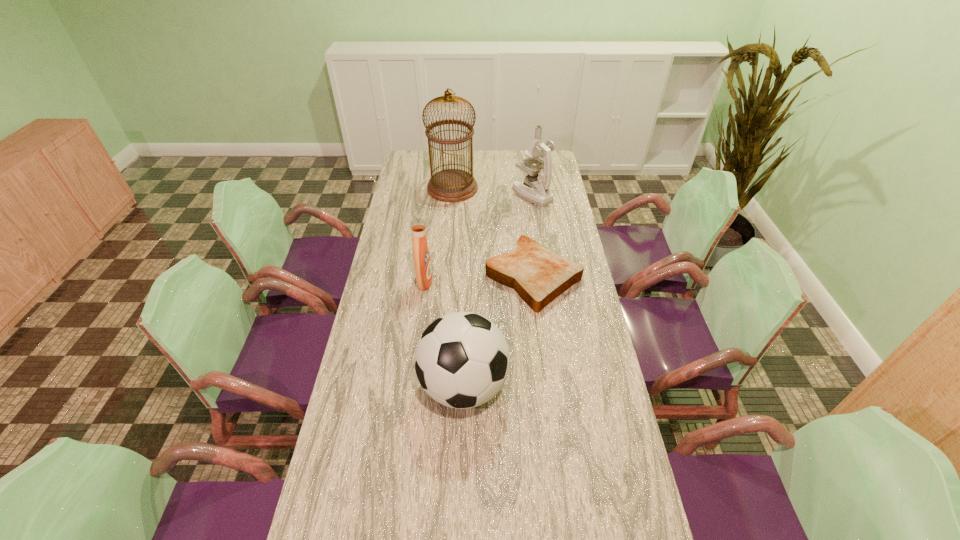
The image size is (960, 540). What are the coordinates of `birdcage situated at the left edge` in the screenshot? It's located at (451, 185).

Find the location of a particular element. detergent present at the left edge is located at coordinates (422, 263).

You are a GUI agent. You are given a task and a screenshot of the screen. Output one action in this format:
    pyautogui.click(x=<x>, y=<y>)
    Task: Click on the microscope situated at the right edge
    The height and width of the screenshot is (540, 960).
    Given the screenshot: What is the action you would take?
    pyautogui.click(x=536, y=190)

The height and width of the screenshot is (540, 960). What are the coordinates of `bread located in the right edge section of the desktop` in the screenshot? It's located at (538, 275).

Find the location of `vacant space at the far edge of the desktop`. vacant space at the far edge of the desktop is located at coordinates (445, 165).

I want to click on free spot at the left edge of the desktop, so click(416, 292).

Locate an element on the screen. Image resolution: width=960 pixels, height=540 pixels. blank space at the right edge of the desktop is located at coordinates (549, 327).

This screenshot has height=540, width=960. I want to click on empty space between the shortest object and the second tallest object, so click(533, 235).

This screenshot has width=960, height=540. In order to click on free space between the soccer ball and the fourth shortest object in this screenshot , I will do `click(498, 290)`.

Where is `vacant area that lies between the microscope and the soccer ball`? Image resolution: width=960 pixels, height=540 pixels. vacant area that lies between the microscope and the soccer ball is located at coordinates (498, 290).